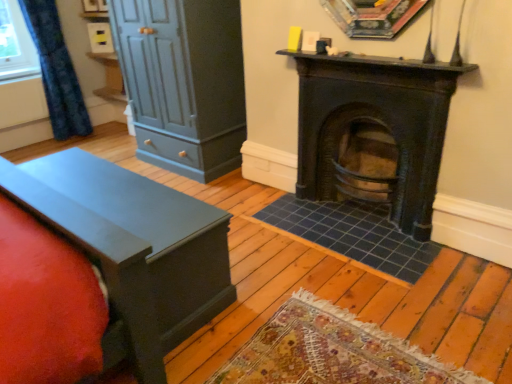
Question: From a real-world perspective, is matte dark gray dresser at left physically located above or below matte black chest at left?

Choices:
 (A) above
 (B) below

Answer: (A)

Question: Is matte dark gray dresser at left wider or thinner than matte black chest at left?

Choices:
 (A) thin
 (B) wide

Answer: (B)

Question: Which is farther from the matte dark gray dresser at left?

Choices:
 (A) dark brown wood burning stove at center
 (B) blue textured curtain at left
 (C) matte black chest at left

Answer: (B)

Question: Estimate the real-world distances between objects in this image. Which object is farther from the matte black chest at left?

Choices:
 (A) dark brown wood burning stove at center
 (B) blue textured curtain at left
 (C) matte dark gray dresser at left

Answer: (B)